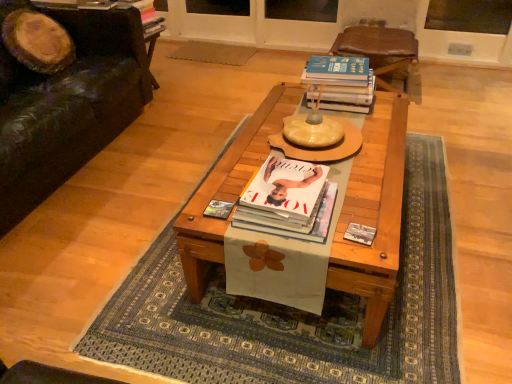
Find the location of `unoccupied space behind white glossy book at center, the 1th book from the bottom`. unoccupied space behind white glossy book at center, the 1th book from the bottom is located at coordinates (264, 160).